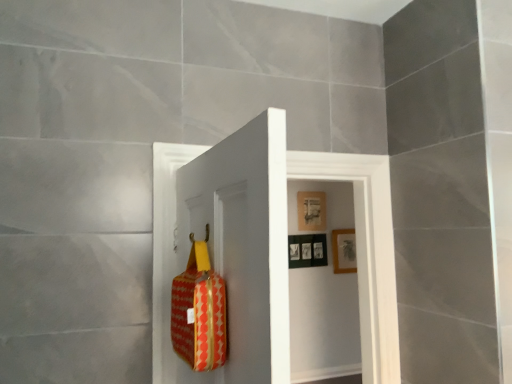
What do you see at coordinates (199, 311) in the screenshot? I see `orange patterned fabric bag at center` at bounding box center [199, 311].

Find the location of a particular element. This screenshot has width=512, height=384. orange patterned fabric bag at center is located at coordinates (199, 311).

I want to click on orange patterned fabric bag at center, so click(199, 311).